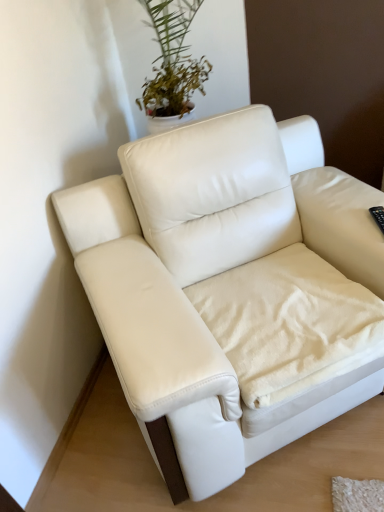
Question: Can you confirm if white leather couch at center is positioned to the right of white soft blanket at center?

Choices:
 (A) yes
 (B) no

Answer: (B)

Question: From the image's perspective, is white leather couch at center below white soft blanket at center?

Choices:
 (A) no
 (B) yes

Answer: (A)

Question: Is white leather couch at center further to the viewer compared to white soft blanket at center?

Choices:
 (A) no
 (B) yes

Answer: (A)

Question: Can you confirm if white leather couch at center is shorter than white soft blanket at center?

Choices:
 (A) no
 (B) yes

Answer: (A)

Question: Can you confirm if white leather couch at center is taller than white soft blanket at center?

Choices:
 (A) yes
 (B) no

Answer: (A)

Question: Considering the relative positions of white leather couch at center and white soft blanket at center in the image provided, is white leather couch at center to the left of white soft blanket at center from the viewer's perspective?

Choices:
 (A) no
 (B) yes

Answer: (B)

Question: Considering the relative sizes of white soft blanket at center and white leather couch at center in the image provided, is white soft blanket at center bigger than white leather couch at center?

Choices:
 (A) yes
 (B) no

Answer: (B)

Question: Is white soft blanket at center to the left of white leather couch at center from the viewer's perspective?

Choices:
 (A) yes
 (B) no

Answer: (B)

Question: Is white soft blanket at center further to camera compared to white leather couch at center?

Choices:
 (A) no
 (B) yes

Answer: (B)

Question: From a real-world perspective, is white soft blanket at center on white leather couch at center?

Choices:
 (A) no
 (B) yes

Answer: (A)

Question: From the image's perspective, is white soft blanket at center on white leather couch at center?

Choices:
 (A) no
 (B) yes

Answer: (A)

Question: Is white soft blanket at center not near white leather couch at center?

Choices:
 (A) yes
 (B) no

Answer: (B)

Question: Based on their sizes in the image, would you say white leather couch at center is bigger or smaller than white soft blanket at center?

Choices:
 (A) big
 (B) small

Answer: (A)